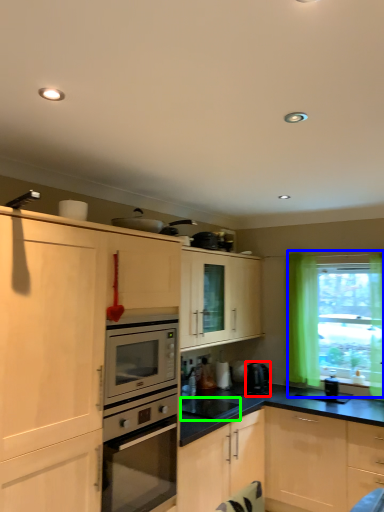
Question: Considering the real-world distances, which object is farthest from coffee machine (highlighted by a red box)? window (highlighted by a blue box) or appliance (highlighted by a green box)?

Choices:
 (A) window
 (B) appliance

Answer: (A)